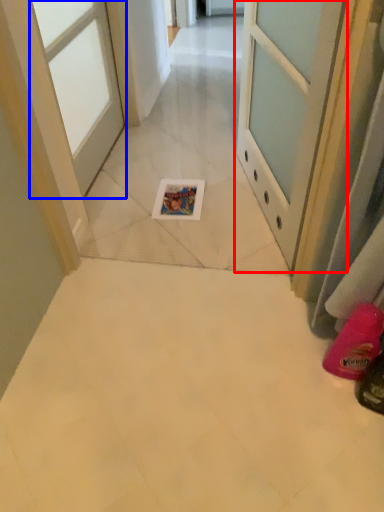
Question: Among these objects, which one is farthest to the camera, door (highlighted by a red box) or door (highlighted by a blue box)?

Choices:
 (A) door
 (B) door

Answer: (B)